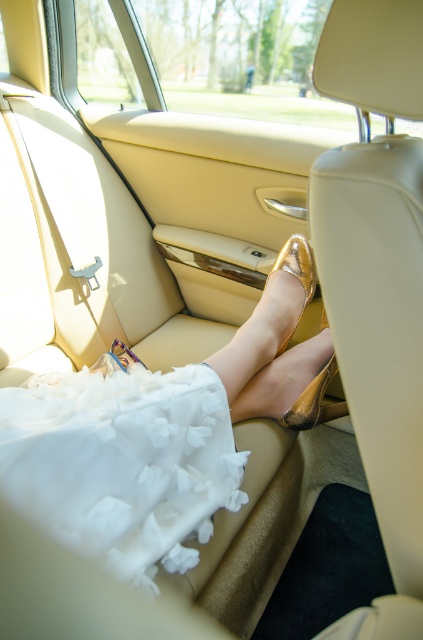
Question: From the image, what is the correct spatial relationship of metallic gold shoe at center in relation to white fluffy dress at lower left?

Choices:
 (A) above
 (B) below

Answer: (A)

Question: Can you confirm if metallic gold shoe at center is bigger than white fluffy dress at lower left?

Choices:
 (A) yes
 (B) no

Answer: (A)

Question: Which point is farther to the camera?

Choices:
 (A) (198, 502)
 (B) (129, 408)

Answer: (A)

Question: Is metallic gold shoe at center below white fluffy dress at lower left?

Choices:
 (A) yes
 (B) no

Answer: (B)